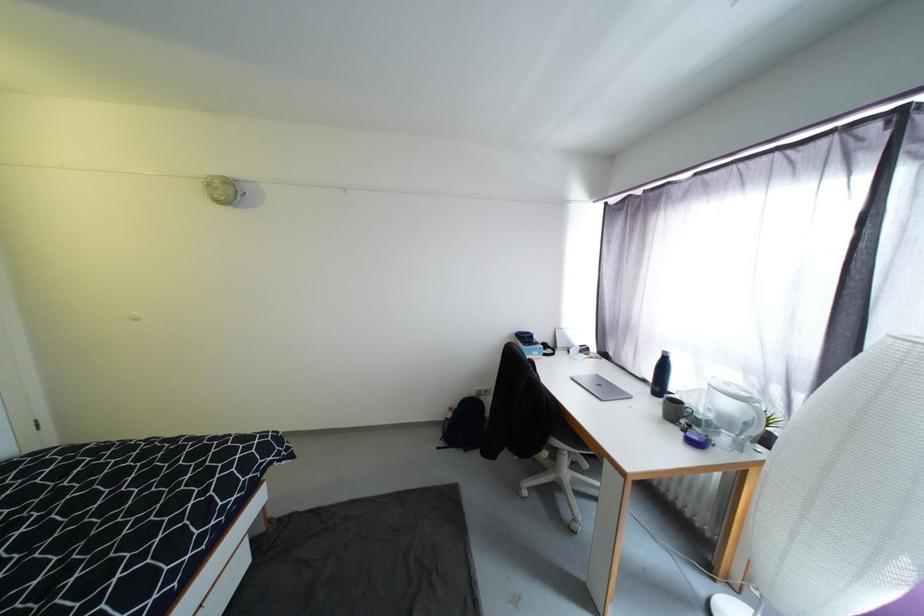
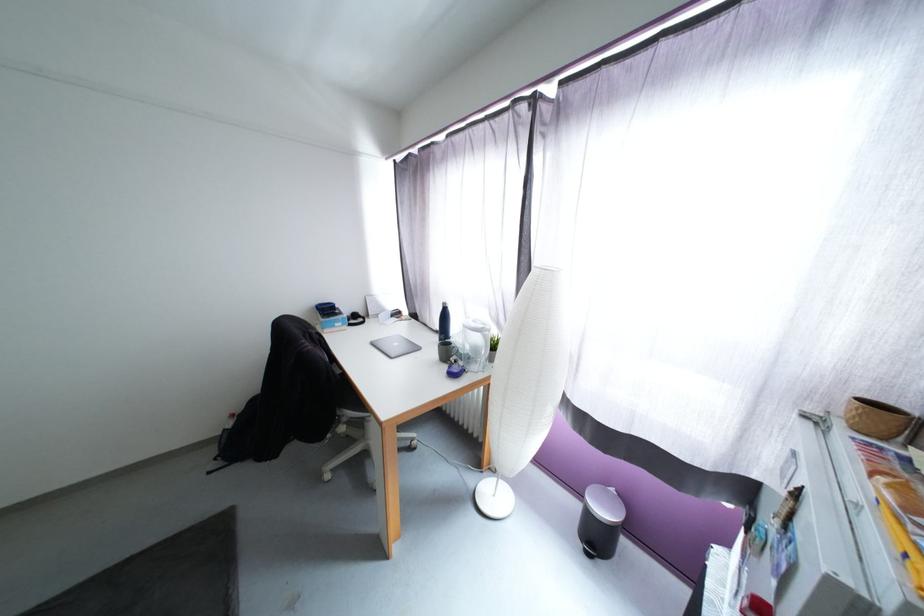
Question: How did the camera likely rotate?

Choices:
 (A) Left
 (B) Right
 (C) Up
 (D) Down

Answer: (B)